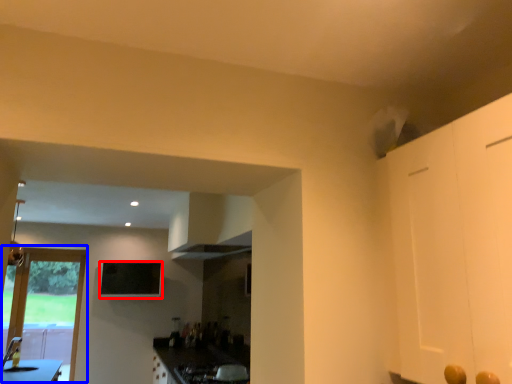
Question: Which point is closer to the camera, window screen (highlighted by a red box) or door (highlighted by a blue box)?

Choices:
 (A) window screen
 (B) door

Answer: (B)